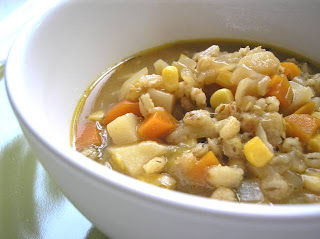
The width and height of the screenshot is (320, 239). In order to click on napkin in this screenshot , I will do `click(54, 224)`.